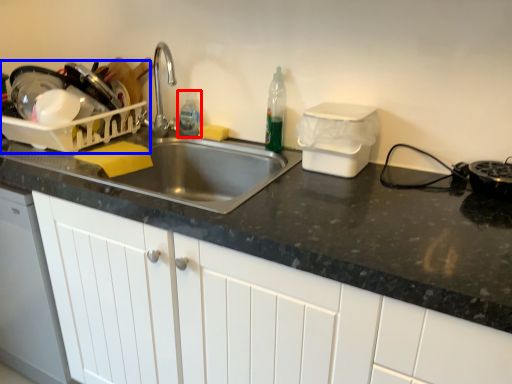
Question: Which point is closer to the camera, bottle (highlighted by a red box) or appliance (highlighted by a blue box)?

Choices:
 (A) bottle
 (B) appliance

Answer: (B)